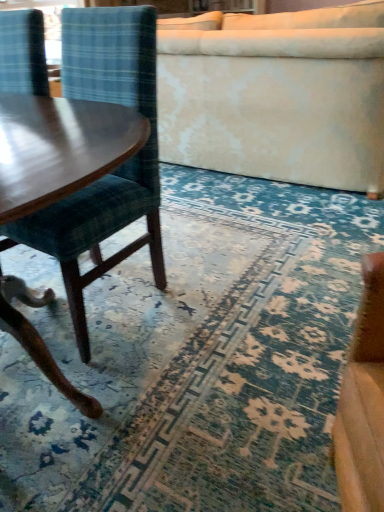
Question: In the image, is velvet plaid chair at left positioned in front of or behind blue textured rug at center?

Choices:
 (A) behind
 (B) front

Answer: (A)

Question: Is velvet plaid chair at left inside the boundaries of blue textured rug at center, or outside?

Choices:
 (A) inside
 (B) outside

Answer: (B)

Question: Which object is the closest to the blue textured rug at center?

Choices:
 (A) velvet cream studio couch at upper center
 (B) velvet plaid chair at left

Answer: (B)

Question: Based on their relative distances, which object is farther from the blue textured rug at center?

Choices:
 (A) velvet cream studio couch at upper center
 (B) velvet plaid chair at left

Answer: (A)